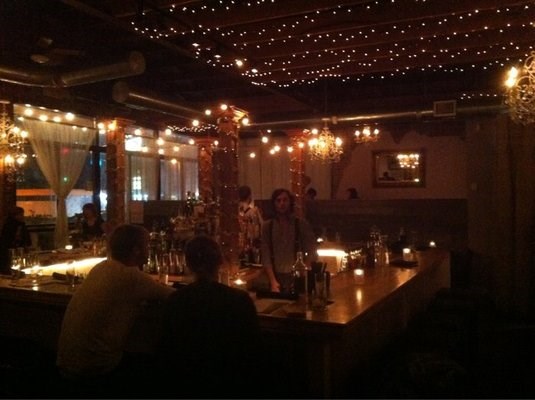
The image size is (535, 400). I want to click on vent on pipe, so click(x=447, y=108).